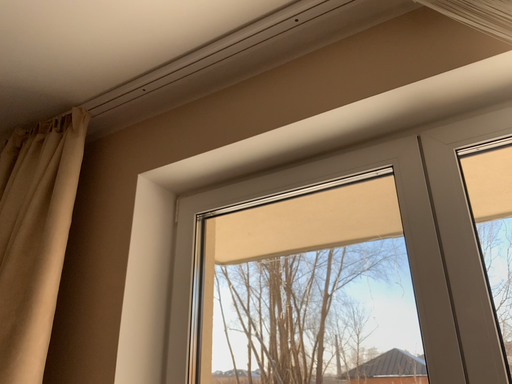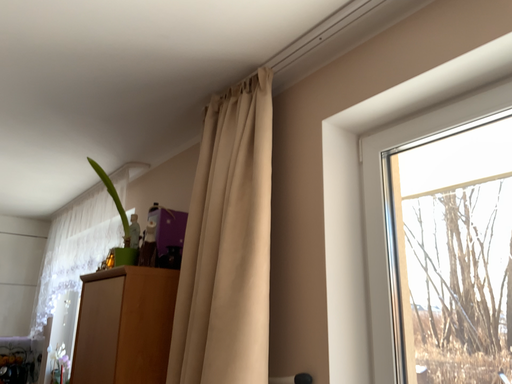
Question: Which way did the camera rotate in the video?

Choices:
 (A) rotated right
 (B) rotated left

Answer: (B)